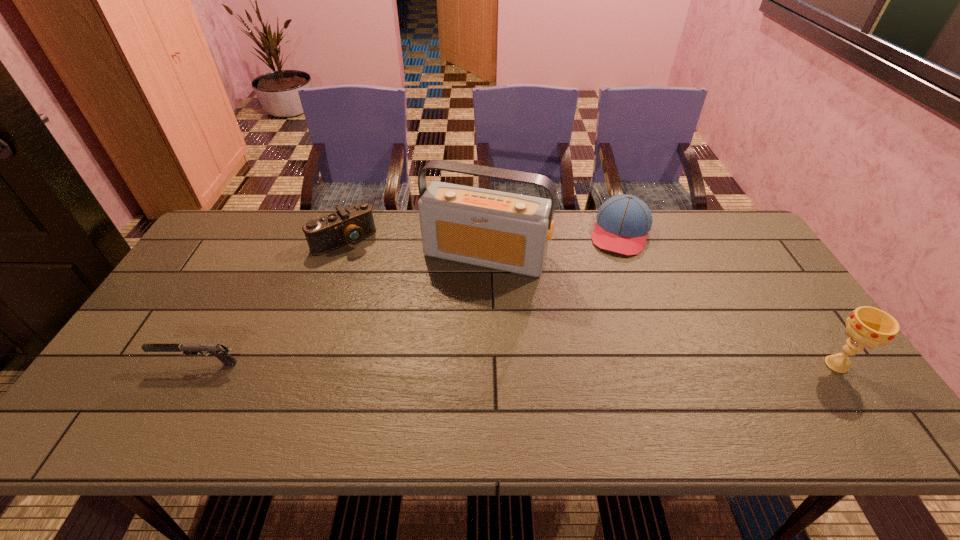
Where is `the leftmost object`? the leftmost object is located at coordinates (220, 351).

At what (x,y) coordinates should I click in order to perform the action: click on the shortest object. Please return your answer as a coordinate pair (x, y). The height and width of the screenshot is (540, 960). Looking at the image, I should click on (220, 351).

Locate an element on the screen. This screenshot has height=540, width=960. the rightmost object is located at coordinates pos(870,327).

Where is `the fourth shortest object`? This screenshot has width=960, height=540. the fourth shortest object is located at coordinates (870, 327).

This screenshot has width=960, height=540. In order to click on the third object from right to left in this screenshot , I will do `click(505, 231)`.

Find the location of a particular element. Image resolution: width=960 pixels, height=540 pixels. radio receiver is located at coordinates (505, 231).

Locate an element on the screen. This screenshot has height=540, width=960. baseball cap is located at coordinates (623, 221).

At what (x,y) coordinates should I click in order to perform the action: click on the second object from left to right. Please return your answer as a coordinate pair (x, y). Looking at the image, I should click on (351, 225).

I want to click on vacant space located at the muzzle end of the leftmost object, so click(133, 364).

You are a GUI agent. You are given a task and a screenshot of the screen. Output one action in this format:
    pyautogui.click(x=<x>, y=<y>)
    Task: Click on the vacant space located 0.060m at the muzzle end of the leftmost object
    This screenshot has width=960, height=540.
    Given the screenshot: What is the action you would take?
    [x=133, y=364]